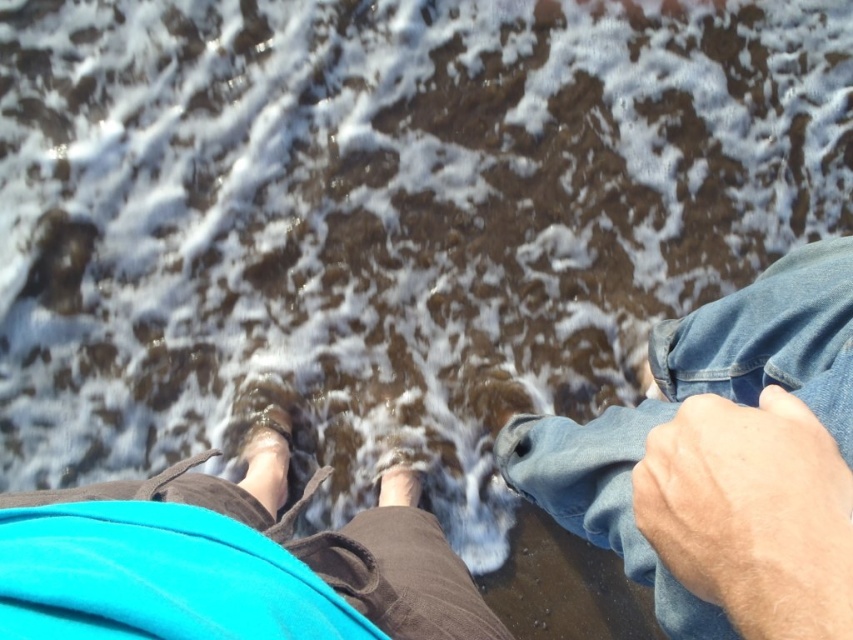
Does denim at lower right have a larger size compared to smooth skin foot at center?

Yes.

Is point (671, 376) positioned after point (381, 476)?

No, (671, 376) is in front of (381, 476).

Locate an element on the screen. denim at lower right is located at coordinates (683, 400).

From the picture: Who is positioned more to the left, denim at lower right or brown suede sandal at lower center?

brown suede sandal at lower center

Who is shorter, denim at lower right or brown suede sandal at lower center?

brown suede sandal at lower center

Identify the location of denim at lower right. This screenshot has width=853, height=640. (683, 400).

Does brown suede sandal at lower center have a greater width compared to smooth skin foot at center?

Indeed, brown suede sandal at lower center has a greater width compared to smooth skin foot at center.

Is brown suede sandal at lower center above smooth skin foot at center?

Yes.

Between point (248, 456) and point (415, 497), which one is positioned in front?

Point (415, 497) is more forward.

You are a GUI agent. You are given a task and a screenshot of the screen. Output one action in this format:
    pyautogui.click(x=<x>, y=<y>)
    Task: Click on the brown suede sandal at lower center
    The image size is (853, 640).
    Given the screenshot: What is the action you would take?
    pyautogui.click(x=265, y=458)